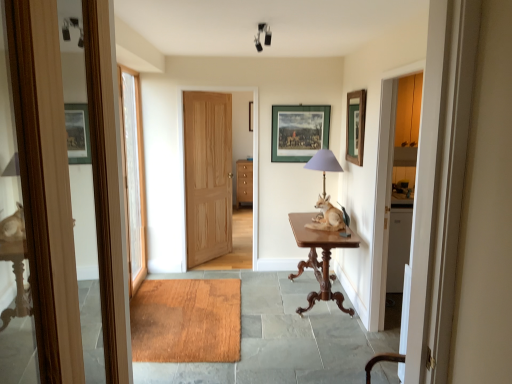
You are a GUI agent. You are given a task and a screenshot of the screen. Output one action in this format:
    pyautogui.click(x=<x>, y=<y>)
    Task: Click on the free space in front of mahogany wood table at center
    The width and height of the screenshot is (512, 384).
    Given the screenshot: What is the action you would take?
    pyautogui.click(x=312, y=341)